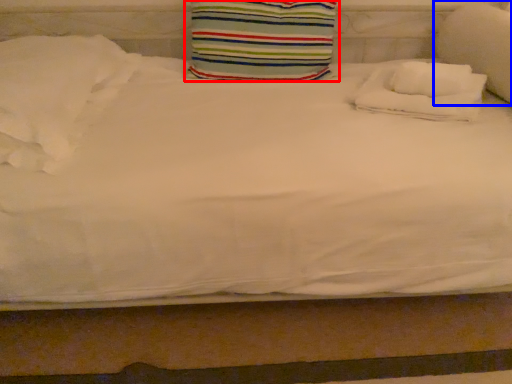
Question: Which object appears closest to the camera in this image, pillow (highlighted by a red box) or pillow (highlighted by a blue box)?

Choices:
 (A) pillow
 (B) pillow

Answer: (B)